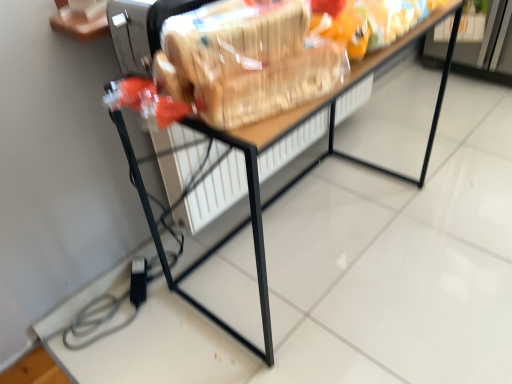
Question: Should I look upward or downward to see wooden table at center?

Choices:
 (A) up
 (B) down

Answer: (A)

Question: Considering the relative positions of translucent plastic bag at center and wooden table at center in the image provided, is translucent plastic bag at center to the right of wooden table at center from the viewer's perspective?

Choices:
 (A) no
 (B) yes

Answer: (A)

Question: From the image's perspective, is translucent plastic bag at center located above wooden table at center?

Choices:
 (A) no
 (B) yes

Answer: (B)

Question: Is translucent plastic bag at center not near wooden table at center?

Choices:
 (A) no
 (B) yes

Answer: (A)

Question: Is translucent plastic bag at center wider than wooden table at center?

Choices:
 (A) yes
 (B) no

Answer: (B)

Question: Is translucent plastic bag at center oriented towards wooden table at center?

Choices:
 (A) no
 (B) yes

Answer: (A)

Question: Is translucent plastic bag at center taller than wooden table at center?

Choices:
 (A) no
 (B) yes

Answer: (A)

Question: Does wooden table at center have a greater height compared to translucent plastic bag at center?

Choices:
 (A) yes
 (B) no

Answer: (A)

Question: Can you confirm if wooden table at center is smaller than translucent plastic bag at center?

Choices:
 (A) no
 (B) yes

Answer: (A)

Question: Is wooden table at center surrounding translucent plastic bag at center?

Choices:
 (A) no
 (B) yes

Answer: (A)

Question: Considering the relative sizes of wooden table at center and translucent plastic bag at center in the image provided, is wooden table at center bigger than translucent plastic bag at center?

Choices:
 (A) no
 (B) yes

Answer: (B)

Question: Could you tell me if wooden table at center is facing translucent plastic bag at center?

Choices:
 (A) yes
 (B) no

Answer: (B)

Question: From a real-world perspective, is wooden table at center on translucent plastic bag at center?

Choices:
 (A) no
 (B) yes

Answer: (A)

Question: Is point (245, 127) positioned closer to the camera than point (210, 119)?

Choices:
 (A) farther
 (B) closer

Answer: (A)